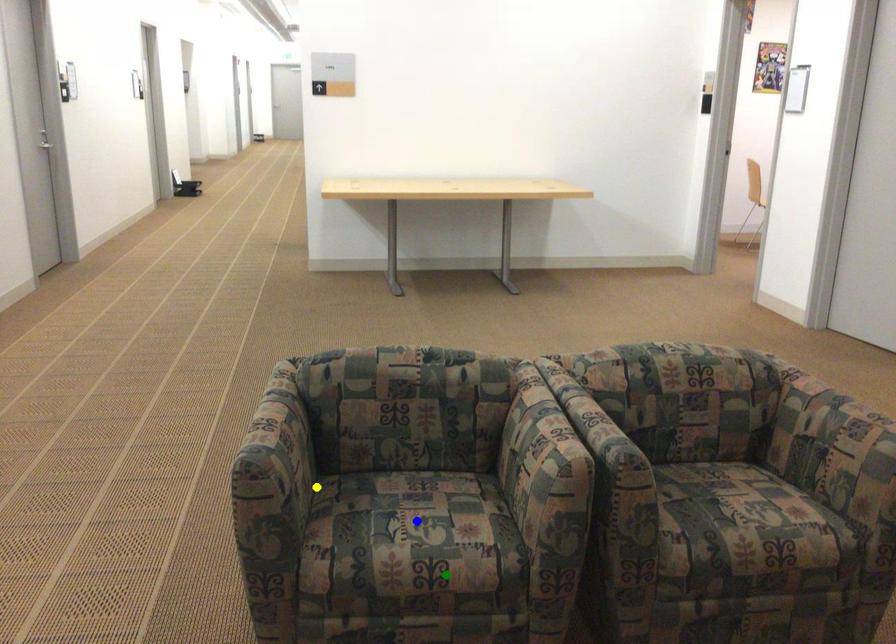
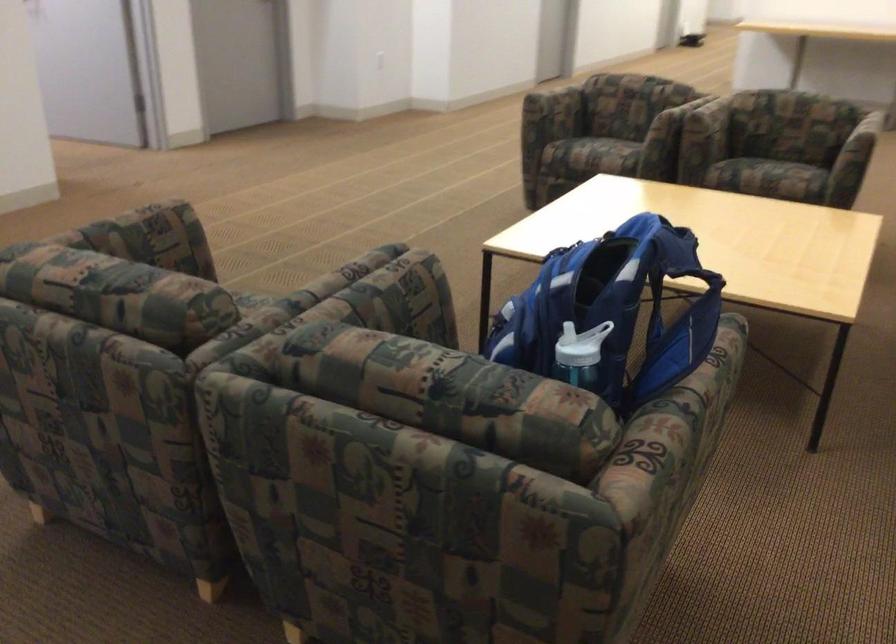
I am providing you with two images of the same scene from different viewpoints. Three points are marked in image1. Which point corresponds to a part or object that is occluded in image2?In image1, three points are marked. Which of them correspond to a part or object that is occluded in image2?Among the three points shown in image1, which one corresponds to a part or object that is no longer visible due to occlusion in image2?

blue point cannot be seen in image2.